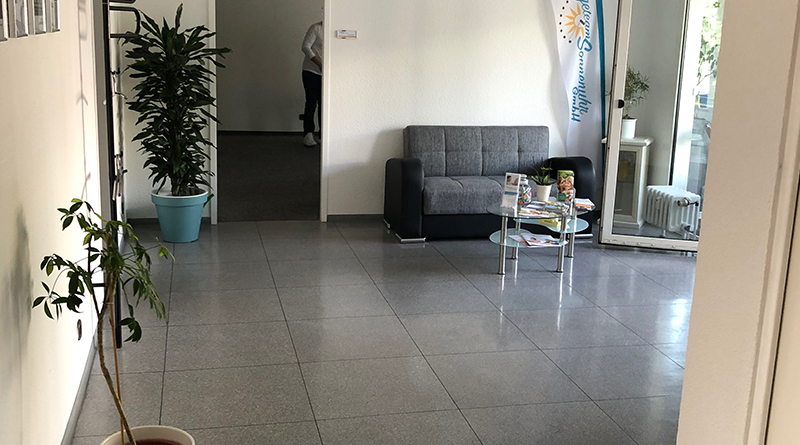
Where is `places to sit`? This screenshot has height=445, width=800. places to sit is located at coordinates (450, 184), (668, 193).